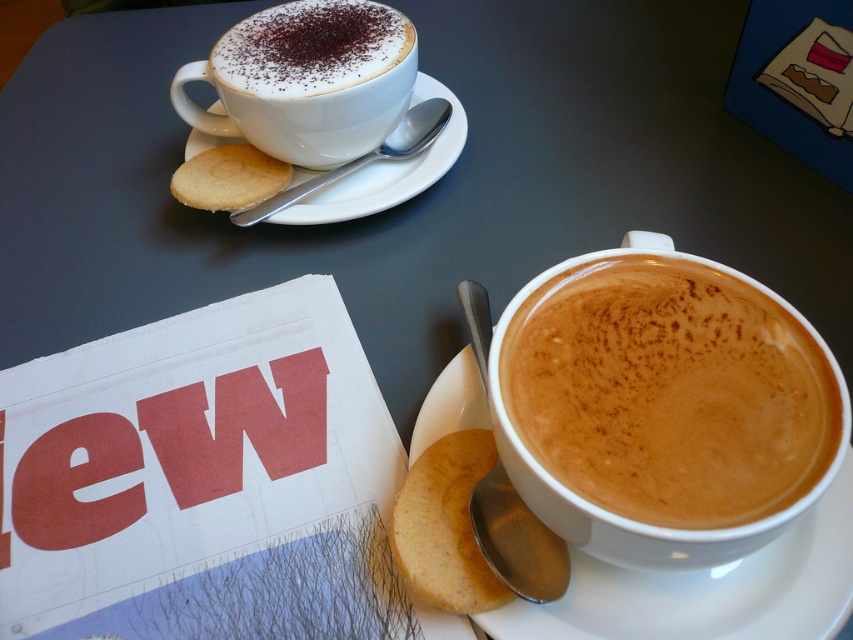
You are a barista preparing to stack these items. Can you place the golden crisp cookie at upper left on top of the white matte cup at upper left without it falling off?

The white matte cup at upper left is much taller than the golden crisp cookie at upper left, so placing the cookie on top would be stable as the cup provides a secure base.

You are a barista preparing coffee and need to choose a saucer that is thinner to place a delicate dessert. Which saucer between the white ceramic saucer at lower right and the white ceramic saucer at upper left should you choose?

The white ceramic saucer at lower right is thinner than the white ceramic saucer at upper left, so you should choose the white ceramic saucer at lower right for the delicate dessert.

You are a barista trying to place a chocolate sprinkle on the cappuccino foam at lower right. Given the coordinates provided, can you confirm the exact position where you should place it?

The cappuccino foam at lower right is located at point [669,392], so you should place the chocolate sprinkle at those coordinates.